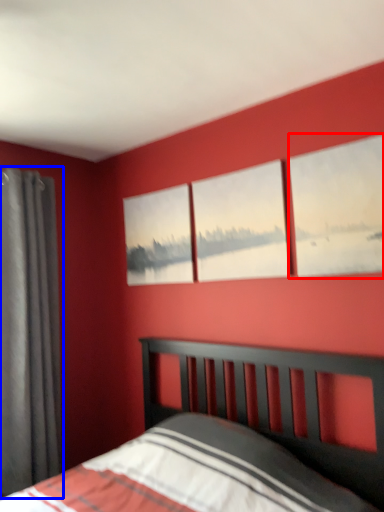
Question: Which point is closer to the camera, window (highlighted by a red box) or curtain (highlighted by a blue box)?

Choices:
 (A) window
 (B) curtain

Answer: (A)